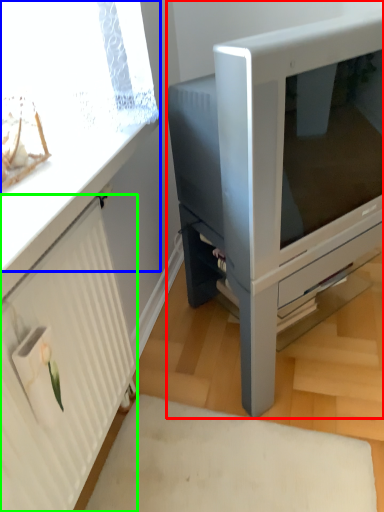
Question: Based on their relative distances, which object is farther from furniture (highlighted by a red box)? Choose from window screen (highlighted by a blue box) and radiator (highlighted by a green box).

Choices:
 (A) window screen
 (B) radiator

Answer: (B)